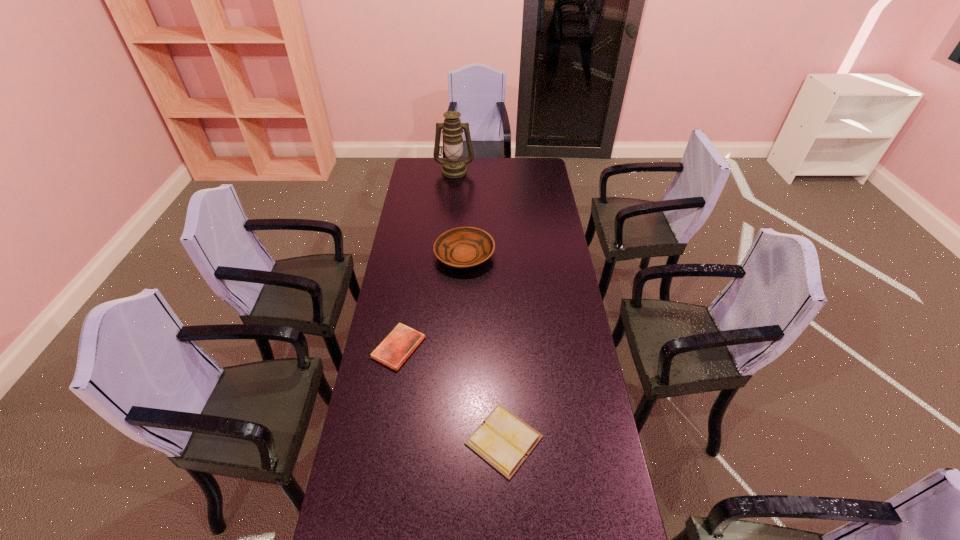
At what (x,y) coordinates should I click in order to perform the action: click on free space located 0.190m on the right of the taller diary. Please return your answer as a coordinate pair (x, y). Image resolution: width=960 pixels, height=540 pixels. Looking at the image, I should click on (605, 440).

This screenshot has width=960, height=540. I want to click on vacant space located 0.400m on the back of the left diary, so click(414, 256).

Locate an element on the screen. object that is positioned at the far edge is located at coordinates (453, 167).

Find the location of a particular element. The height and width of the screenshot is (540, 960). oil lamp positioned at the left edge is located at coordinates (453, 167).

I want to click on diary that is at the left edge, so click(400, 343).

Locate an element on the screen. The width and height of the screenshot is (960, 540). object located at the far left corner is located at coordinates (453, 167).

You are a GUI agent. You are given a task and a screenshot of the screen. Output one action in this format:
    pyautogui.click(x=<x>, y=<y>)
    Task: Click on the vacant space at the far edge of the desktop
    
    Given the screenshot: What is the action you would take?
    pyautogui.click(x=496, y=168)

Find the location of a particular element. The image size is (960, 540). free space at the left edge is located at coordinates (411, 388).

In the image, there is a desktop. What are the coordinates of `vacant space at the right edge` in the screenshot? It's located at (531, 195).

Image resolution: width=960 pixels, height=540 pixels. Identify the location of vacant region at the far left corner of the desktop. (420, 158).